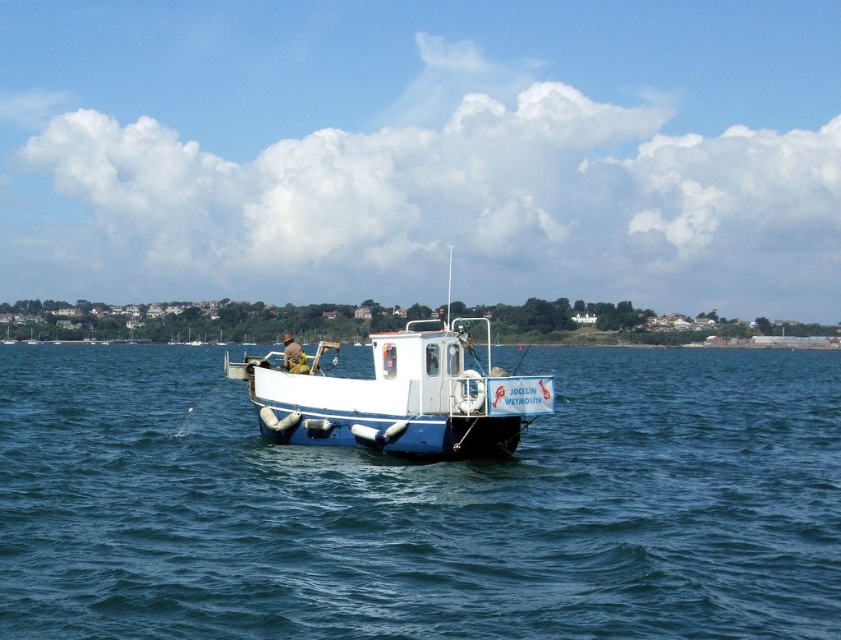
Question: Which object is farther from the camera taking this photo?

Choices:
 (A) white matte boat at center
 (B) blue rubber boat at center

Answer: (A)

Question: Is the position of blue rubber boat at center less distant than that of white matte boat at center?

Choices:
 (A) yes
 (B) no

Answer: (A)

Question: Which object is farther from the camera taking this photo?

Choices:
 (A) white matte boat at center
 (B) blue rubber boat at center

Answer: (A)

Question: In this image, where is blue rubber boat at center located relative to white matte boat at center?

Choices:
 (A) below
 (B) above

Answer: (A)

Question: Does blue rubber boat at center appear on the right side of white matte boat at center?

Choices:
 (A) yes
 (B) no

Answer: (B)